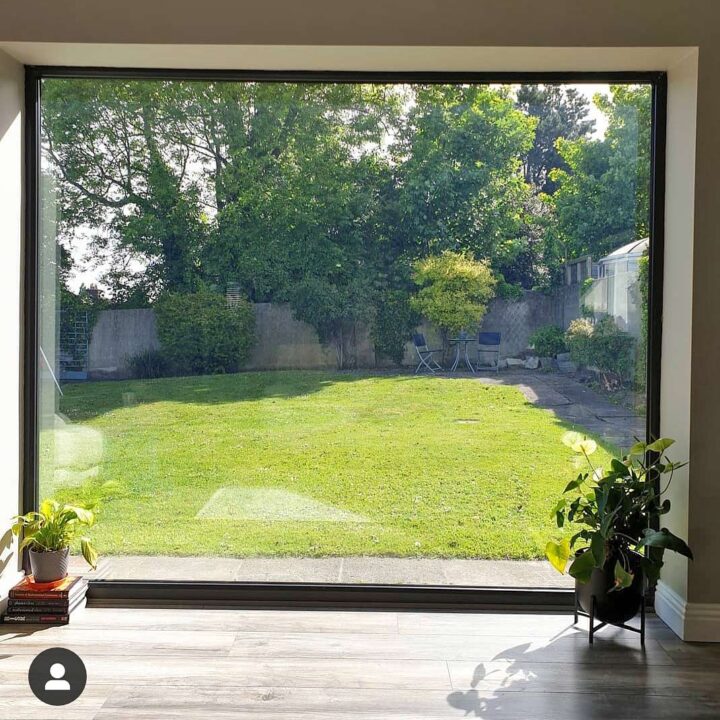
Find the location of a particular element. window frame is located at coordinates (477, 595), (656, 394), (27, 412).